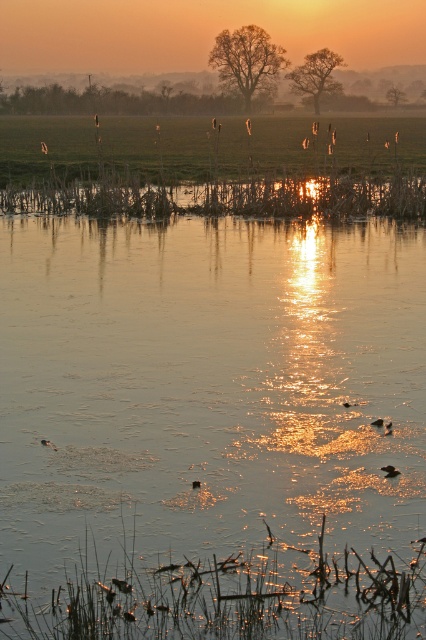
You are standing at the edge of the water and notice the translucent water at center and the translucent reed at center. Which object is taller from your viewpoint?

The translucent water at center is much taller than the translucent reed at center from your viewpoint.

You are standing at the edge of the water and want to place a small floating decoration between the translucent water at center and the translucent reed at center. If the decoration is 2 meters long, will it fit between them without touching either object?

The distance between the translucent water at center and the translucent reed at center is 4.67 meters. Since the decoration is only 2 meters long, it will fit comfortably between them without touching either object.

You are standing at the edge of the water and want to place a small floating decoration exactly at the center of the translucent water at center. According to the coordinates provided, where should you position it?

The translucent water at center is located at point (213,412), so you should position the decoration at those coordinates to place it exactly at the center.